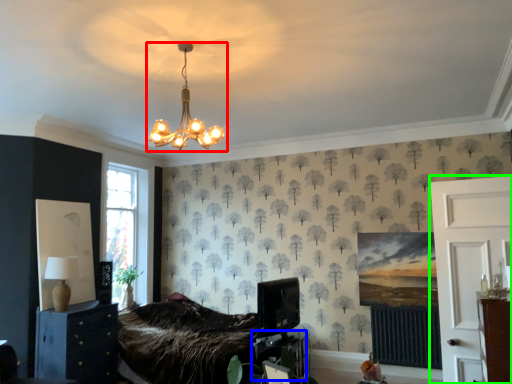
Question: Estimate the real-world distances between objects in this image. Which object is farther from lamp (highlighted by a red box), table (highlighted by a blue box) or side (highlighted by a green box)?

Choices:
 (A) table
 (B) side

Answer: (B)